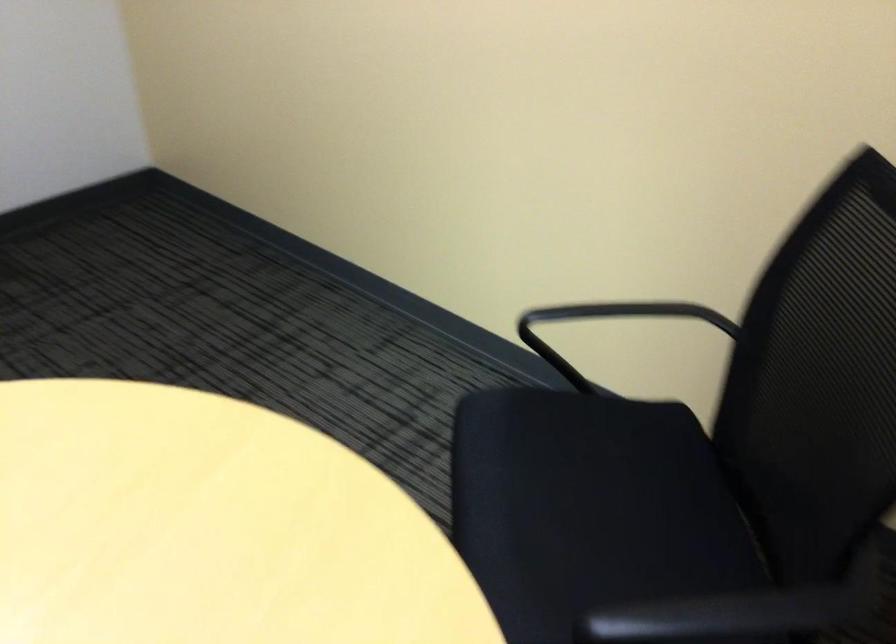
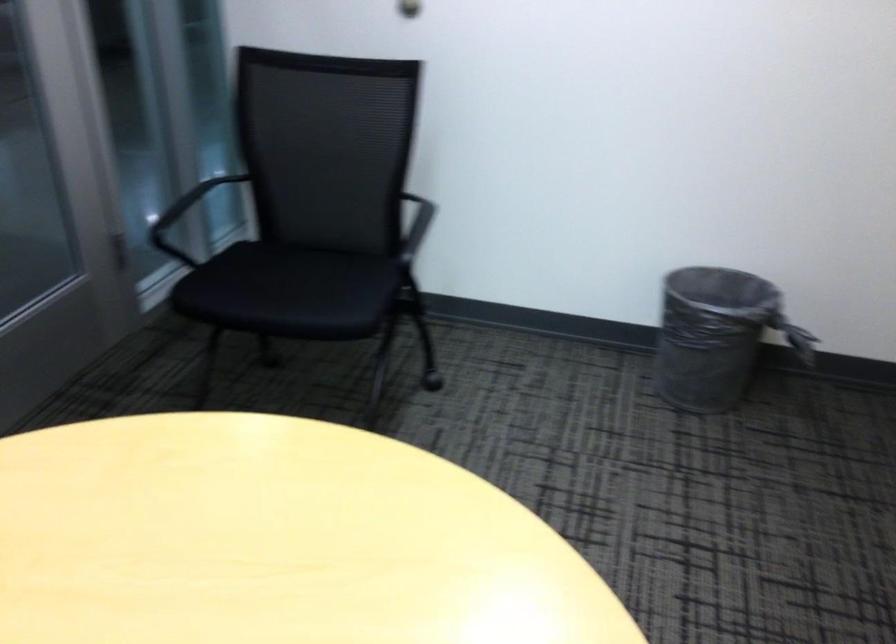
Question: The first image is from the beginning of the video and the second image is from the end. How did the camera likely rotate when shooting the video?

Choices:
 (A) Left
 (B) Right
 (C) Up
 (D) Down

Answer: (A)